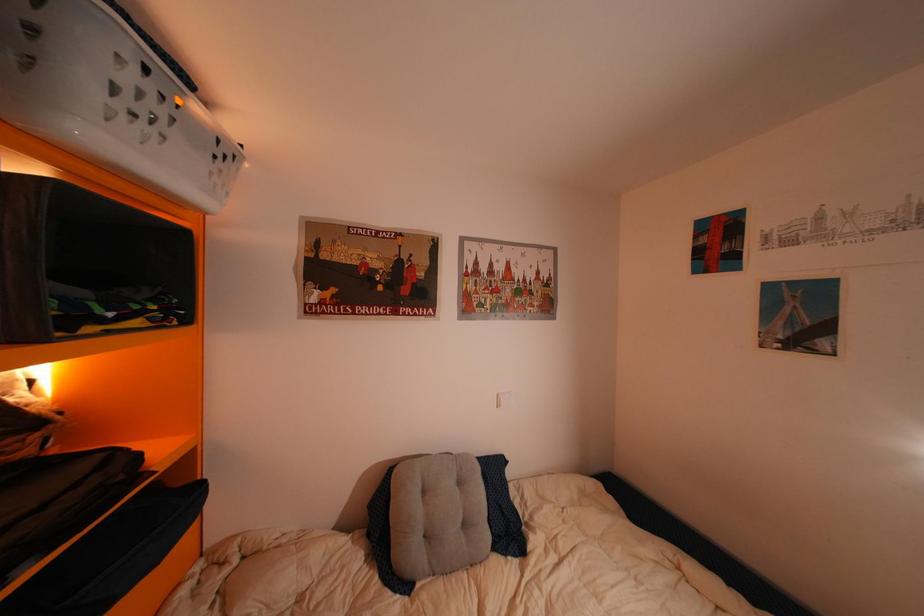
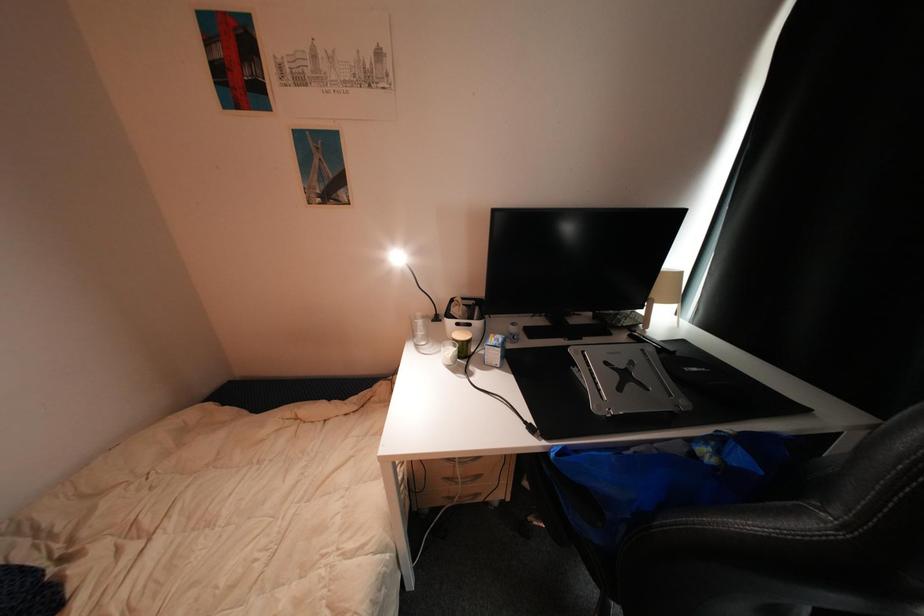
The images are taken continuously from a first-person perspective. In which direction is your viewpoint rotating?

The camera rotated toward right-down.